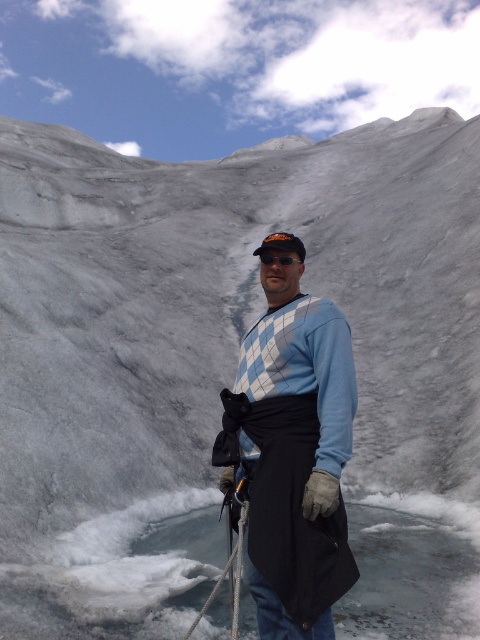
Question: Which point appears farthest from the camera in this image?

Choices:
 (A) (285, 257)
 (B) (298, 305)
 (C) (235, 572)

Answer: (C)

Question: Can you confirm if blue argyle sweater at center is positioned to the left of transparent plastic goggles at center?

Choices:
 (A) yes
 (B) no

Answer: (A)

Question: Which of the following is the closest to the observer?

Choices:
 (A) transparent plastic goggles at center
 (B) white nylon rope at center

Answer: (B)

Question: Which of the following is the farthest from the observer?

Choices:
 (A) white nylon rope at center
 (B) transparent plastic goggles at center
 (C) blue argyle sweater at center

Answer: (B)

Question: Does blue argyle sweater at center have a larger size compared to transparent plastic goggles at center?

Choices:
 (A) no
 (B) yes

Answer: (B)

Question: Can you confirm if blue argyle sweater at center is positioned above white nylon rope at center?

Choices:
 (A) no
 (B) yes

Answer: (B)